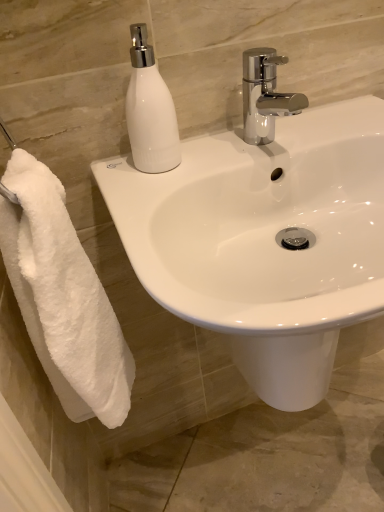
Where is `white glossy soap dispenser at upper left`? The image size is (384, 512). white glossy soap dispenser at upper left is located at coordinates (150, 110).

Find the location of a particular element. white glossy soap dispenser at upper left is located at coordinates (150, 110).

Is white glossy soap dispenser at upper left inside the boundaries of white fluffy towel at left, or outside?

white glossy soap dispenser at upper left lies outside white fluffy towel at left.

I want to click on towel in front of the white glossy soap dispenser at upper left, so click(x=63, y=298).

Does white glossy soap dispenser at upper left have a larger size compared to white fluffy towel at left?

Actually, white glossy soap dispenser at upper left might be smaller than white fluffy towel at left.

Could you tell me if white glossy soap dispenser at upper left is turned towards white fluffy towel at left?

No, white glossy soap dispenser at upper left is not facing towards white fluffy towel at left.

Between white fluffy towel at left and chrome metallic faucet at upper center, which one has smaller size?

With smaller size is chrome metallic faucet at upper center.

From the image's perspective, which one is positioned lower, white fluffy towel at left or chrome metallic faucet at upper center?

From the image's view, white fluffy towel at left is below.

Is white fluffy towel at left further to the viewer compared to chrome metallic faucet at upper center?

No, white fluffy towel at left is closer to the viewer.

Is point (82, 405) closer or farther from the camera than point (264, 66)?

Point (82, 405) is positioned farther from the camera compared to point (264, 66).

From the image's perspective, which is below, white glossy sink at center or white fluffy towel at left?

white glossy sink at center is shown below in the image.

Is the depth of white glossy sink at center less than that of white fluffy towel at left?

That is True.

How different are the orientations of white glossy sink at center and white fluffy towel at left in degrees?

90 degrees.

Is white glossy sink at center at the left side of white fluffy towel at left?

In fact, white glossy sink at center is to the right of white fluffy towel at left.

Are chrome metallic faucet at upper center and white glossy soap dispenser at upper left making contact?

No, chrome metallic faucet at upper center is not beside white glossy soap dispenser at upper left.

Who is taller, chrome metallic faucet at upper center or white glossy soap dispenser at upper left?

With more height is white glossy soap dispenser at upper left.

Which is in front, point (258, 81) or point (140, 29)?

The point (140, 29) is closer to the camera.

How different are the orientations of chrome metallic faucet at upper center and white glossy soap dispenser at upper left in degrees?

They differ by 0.00383 degrees in their facing directions.

Considering the sizes of objects white glossy sink at center and white glossy soap dispenser at upper left in the image provided, who is bigger, white glossy sink at center or white glossy soap dispenser at upper left?

With larger size is white glossy sink at center.

Is white glossy sink at center wider than white glossy soap dispenser at upper left?

Indeed, white glossy sink at center has a greater width compared to white glossy soap dispenser at upper left.

From the image's perspective, which one is positioned higher, white glossy sink at center or white glossy soap dispenser at upper left?

white glossy soap dispenser at upper left appears higher in the image.

At what (x,y) coordinates should I click in order to perform the action: click on soap dispenser that is behind the white glossy sink at center. Please return your answer as a coordinate pair (x, y). Looking at the image, I should click on (150, 110).

Considering the positions of objects white glossy sink at center and chrome metallic faucet at upper center in the image provided, who is in front, white glossy sink at center or chrome metallic faucet at upper center?

white glossy sink at center is more forward.

From the picture: Measure the distance from white glossy sink at center to chrome metallic faucet at upper center.

The distance of white glossy sink at center from chrome metallic faucet at upper center is 7.34 inches.

Considering the relative sizes of white glossy sink at center and chrome metallic faucet at upper center in the image provided, is white glossy sink at center wider than chrome metallic faucet at upper center?

Yes, white glossy sink at center is wider than chrome metallic faucet at upper center.

In the image, is white fluffy towel at left on the left side or the right side of white glossy soap dispenser at upper left?

Based on their positions, white fluffy towel at left is located to the left of white glossy soap dispenser at upper left.

What's the angular difference between white fluffy towel at left and white glossy soap dispenser at upper left's facing directions?

There is a 90-degree angle between the facing directions of white fluffy towel at left and white glossy soap dispenser at upper left.

Is white fluffy towel at left not inside white glossy soap dispenser at upper left?

Absolutely, white fluffy towel at left is external to white glossy soap dispenser at upper left.

Between white fluffy towel at left and white glossy soap dispenser at upper left, which one has smaller size?

With smaller size is white glossy soap dispenser at upper left.

Locate an element on the screen. soap dispenser located behind the white fluffy towel at left is located at coordinates (150, 110).

This screenshot has height=512, width=384. In order to click on tap to the right of white fluffy towel at left in this screenshot , I will do `click(265, 95)`.

When comparing their distances from white glossy soap dispenser at upper left, does white fluffy towel at left or white glossy sink at center seem closer?

white glossy sink at center.

Which object lies nearer to the anchor point white glossy sink at center, white fluffy towel at left or chrome metallic faucet at upper center?

chrome metallic faucet at upper center is positioned closer to the anchor white glossy sink at center.

Looking at the image, which one is located further to white glossy soap dispenser at upper left, white glossy sink at center or chrome metallic faucet at upper center?

white glossy sink at center is further to white glossy soap dispenser at upper left.

When comparing their distances from chrome metallic faucet at upper center, does white glossy sink at center or white fluffy towel at left seem further?

white fluffy towel at left.

Which object lies further to the anchor point chrome metallic faucet at upper center, white glossy soap dispenser at upper left or white fluffy towel at left?

white fluffy towel at left.

When comparing their distances from white fluffy towel at left, does white glossy sink at center or white glossy soap dispenser at upper left seem further?

white glossy soap dispenser at upper left is further to white fluffy towel at left.

Looking at the image, which one is located further to white glossy sink at center, white fluffy towel at left or white glossy soap dispenser at upper left?

Among the two, white fluffy towel at left is located further to white glossy sink at center.

Estimate the real-world distances between objects in this image. Which object is further from white fluffy towel at left, white glossy sink at center or chrome metallic faucet at upper center?

chrome metallic faucet at upper center.

Find the location of a particular element. This screenshot has height=512, width=384. soap dispenser between white fluffy towel at left and white glossy sink at center in the horizontal direction is located at coordinates (150, 110).

In order to click on soap dispenser located between white fluffy towel at left and chrome metallic faucet at upper center in the left-right direction in this screenshot , I will do `click(150, 110)`.

At what (x,y) coordinates should I click in order to perform the action: click on tap located between white fluffy towel at left and white glossy sink at center in the left-right direction. Please return your answer as a coordinate pair (x, y). Looking at the image, I should click on (265, 95).

You are a GUI agent. You are given a task and a screenshot of the screen. Output one action in this format:
    pyautogui.click(x=<x>, y=<y>)
    Task: Click on the soap dispenser that lies between chrome metallic faucet at upper center and white glossy sink at center from top to bottom
    The height and width of the screenshot is (512, 384).
    Given the screenshot: What is the action you would take?
    pyautogui.click(x=150, y=110)